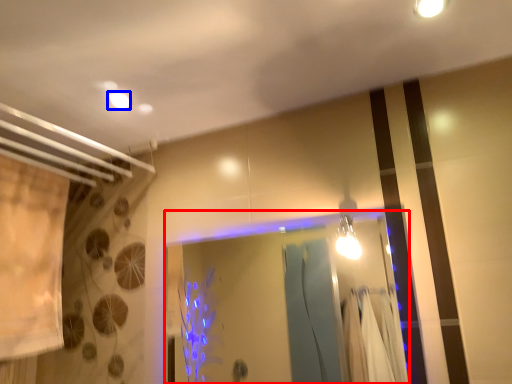
Question: Among these objects, which one is farthest to the camera, glass door (highlighted by a red box) or lighting (highlighted by a blue box)?

Choices:
 (A) glass door
 (B) lighting

Answer: (B)